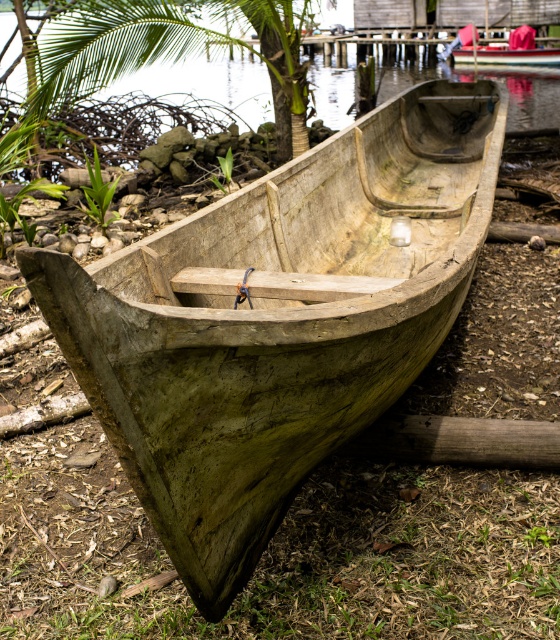
You are standing in front of the boat and want to know which of the two points, point (x=273, y=108) or point (x=459, y=42), is closer to you. Can you determine this based on the scene?

Point (x=273, y=108) is closer to the viewer than point (x=459, y=42).

You are a hiker who has just arrived at the lakeside. You see a green leafy tree at upper left and a wooden canoe at center. Which object is bigger in size?

The green leafy tree at upper left is larger in size compared to the wooden canoe at center.